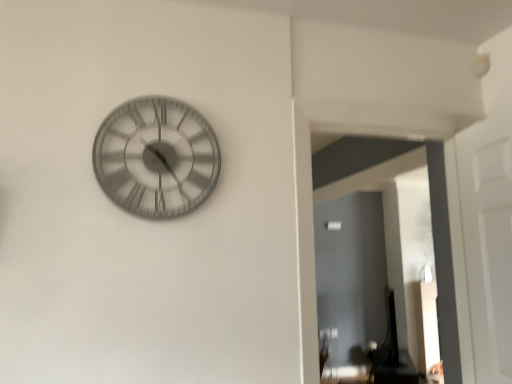
I want to click on metallic silver clock at upper left, so click(156, 157).

What do you see at coordinates (156, 157) in the screenshot?
I see `metallic silver clock at upper left` at bounding box center [156, 157].

What is the approximate width of metallic silver clock at upper left?

metallic silver clock at upper left is 2.41 inches wide.

Describe the element at coordinates (381, 165) in the screenshot. I see `transparent glass door at right` at that location.

This screenshot has width=512, height=384. Find the location of `transparent glass door at right`. transparent glass door at right is located at coordinates (381, 165).

Locate an element on the screen. Image resolution: width=512 pixels, height=384 pixels. metallic silver clock at upper left is located at coordinates (156, 157).

From the picture: Which object is positioned more to the left, transparent glass door at right or metallic silver clock at upper left?

metallic silver clock at upper left is more to the left.

Between transparent glass door at right and metallic silver clock at upper left, which one is positioned in front?

metallic silver clock at upper left is more forward.

Is point (443, 216) positioned behind point (187, 138)?

Yes, it is.

From the image's perspective, is transparent glass door at right located above or below metallic silver clock at upper left?

Clearly, from the image's perspective, transparent glass door at right is below metallic silver clock at upper left.

From a real-world perspective, between transparent glass door at right and metallic silver clock at upper left, who is vertically higher?

metallic silver clock at upper left is physically above.

Does transparent glass door at right have a greater width compared to metallic silver clock at upper left?

Yes, transparent glass door at right is wider than metallic silver clock at upper left.

Between transparent glass door at right and metallic silver clock at upper left, which one has more height?

transparent glass door at right is taller.

Who is bigger, transparent glass door at right or metallic silver clock at upper left?

transparent glass door at right.

Is metallic silver clock at upper left completely or partially inside transparent glass door at right?

No, metallic silver clock at upper left is not surrounded by transparent glass door at right.

Is transparent glass door at right not close to metallic silver clock at upper left?

Yes, transparent glass door at right and metallic silver clock at upper left are located far from each other.

Is transparent glass door at right oriented towards metallic silver clock at upper left?

Yes, transparent glass door at right is turned towards metallic silver clock at upper left.

How far apart are transparent glass door at right and metallic silver clock at upper left?

The distance of transparent glass door at right from metallic silver clock at upper left is 1.45 meters.

Find the location of a particular element. Image resolution: width=512 pixels, height=384 pixels. glass door below the metallic silver clock at upper left (from the image's perspective) is located at coordinates (381, 165).

Would you say metallic silver clock at upper left is to the left or to the right of transparent glass door at right in the picture?

From the image, it's evident that metallic silver clock at upper left is to the left of transparent glass door at right.

Which is in front, metallic silver clock at upper left or transparent glass door at right?

metallic silver clock at upper left is closer to the camera.

Is point (189, 133) behind point (354, 141)?

No, (189, 133) is in front of (354, 141).

From the image's perspective, is metallic silver clock at upper left positioned above or below transparent glass door at right?

metallic silver clock at upper left is situated higher than transparent glass door at right in the image.

From a real-world perspective, is metallic silver clock at upper left beneath transparent glass door at right?

Actually, metallic silver clock at upper left is physically above transparent glass door at right in the real world.

Which of these two, metallic silver clock at upper left or transparent glass door at right, is thinner?

metallic silver clock at upper left is thinner.

Based on the photo, in terms of height, does metallic silver clock at upper left look taller or shorter compared to transparent glass door at right?

Considering their sizes, metallic silver clock at upper left has less height than transparent glass door at right.

Can you confirm if metallic silver clock at upper left is bigger than transparent glass door at right?

No, metallic silver clock at upper left is not bigger than transparent glass door at right.

Would you say metallic silver clock at upper left is outside transparent glass door at right?

Yes, metallic silver clock at upper left is not within transparent glass door at right.

Are metallic silver clock at upper left and transparent glass door at right far apart?

Yes, metallic silver clock at upper left is far from transparent glass door at right.

Is metallic silver clock at upper left facing towards transparent glass door at right?

No, metallic silver clock at upper left does not turn towards transparent glass door at right.

Locate an element on the screen. The width and height of the screenshot is (512, 384). glass door behind the metallic silver clock at upper left is located at coordinates (381, 165).

At what (x,y) coordinates should I click in order to perform the action: click on wall clock on the left of the transparent glass door at right. Please return your answer as a coordinate pair (x, y). The image size is (512, 384). Looking at the image, I should click on (156, 157).

Identify the location of glass door behind the metallic silver clock at upper left. The height and width of the screenshot is (384, 512). (381, 165).